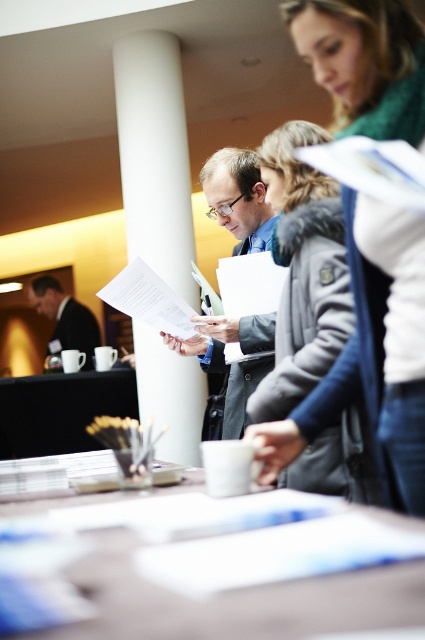
You are attending a conference and want to know if the white smooth column at center is taller than the matte black suit at center. Can you confirm this based on the scene?

The white smooth column at center has a greater height compared to the matte black suit at center, so yes, the white smooth column at center is taller than the matte black suit at center.

You are attending a conference and notice the green scarf at upper right and the white smooth column at center. Which object is shorter in height?

The green scarf at upper right is shorter than the white smooth column at center.

You are standing in the conference setting and want to move from the point at coordinates point (150, 189) to the point at coordinates point (240, 410). Which direction should you move in to get closer to your destination?

To move from point (150, 189) to point (240, 410), you should move towards the background since point (150, 189) is closer to the viewer than point (240, 410).